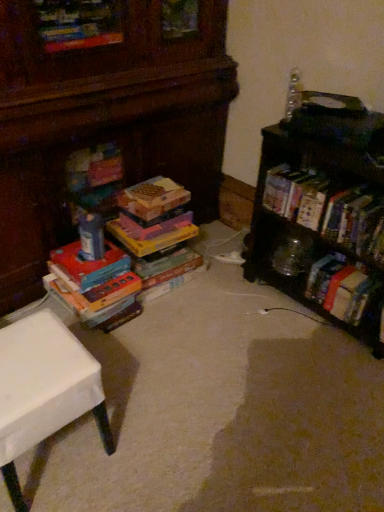
Question: Considering the positions of wooden bookshelf at right and multicolored cardboard books at left, which is the first book in left-to-right order, in the image, is wooden bookshelf at right wider or thinner than multicolored cardboard books at left, which is the first book in left-to-right order,?

Choices:
 (A) thin
 (B) wide

Answer: (B)

Question: Is wooden bookshelf at right in front of or behind multicolored cardboard books at left, the 2th book in the right-to-left sequence, in the image?

Choices:
 (A) behind
 (B) front

Answer: (B)

Question: Which of these objects is positioned farthest from the clear plastic bottle at upper right, which is the second toy from left to right?

Choices:
 (A) white matte table at lower left
 (B) hardcover book at right, the 1th book positioned from the right
 (C) matte plastic toy at center, marked as the first toy in a bottom-to-top arrangement
 (D) multicolored cardboard books at left, the 2th book in the right-to-left sequence
 (E) wooden bookshelf at right

Answer: (A)

Question: Which object is positioned closest to the white matte table at lower left?

Choices:
 (A) matte plastic toy at center, the second toy in the top-to-bottom sequence
 (B) multicolored cardboard books at left, the 2th book in the right-to-left sequence
 (C) wooden bookshelf at right
 (D) hardcover book at right, arranged as the 2th book when viewed from the left
 (E) clear plastic bottle at upper right, the 1th toy from the top

Answer: (B)